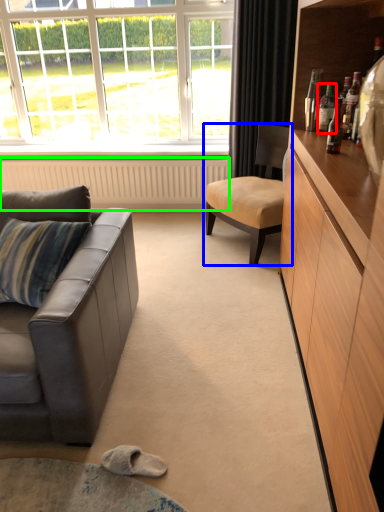
Question: Which object is positioned farthest from bottle (highlighted by a red box)? Select from chair (highlighted by a blue box) and radiator (highlighted by a green box).

Choices:
 (A) chair
 (B) radiator

Answer: (B)